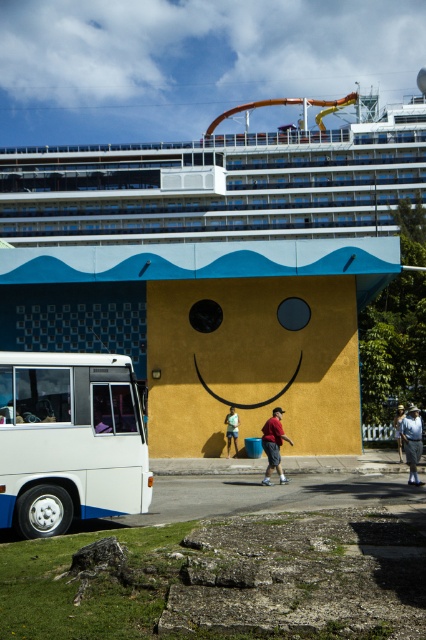
Question: Among these objects, which one is farthest from the camera?

Choices:
 (A) white glossy cruise ship at upper center
 (B) light brown wooden hat at center
 (C) yellow matte face at center

Answer: (A)

Question: Among these points, which one is farthest from the camera?

Choices:
 (A) (233, 410)
 (B) (400, 410)
 (C) (192, 179)
 (D) (29, 388)

Answer: (C)

Question: Observing the image, what is the correct spatial positioning of white glossy cruise ship at upper center in reference to light brown wooden hat at center?

Choices:
 (A) left
 (B) right

Answer: (A)

Question: Which of the following is the closest to the observer?

Choices:
 (A) (376, 108)
 (B) (414, 426)

Answer: (B)

Question: Does yellow matte face at center appear under light brown wooden hat at center?

Choices:
 (A) yes
 (B) no

Answer: (A)

Question: Where is white matte tour bus at lower left located in relation to matte red shirt at center in the image?

Choices:
 (A) below
 (B) above

Answer: (B)